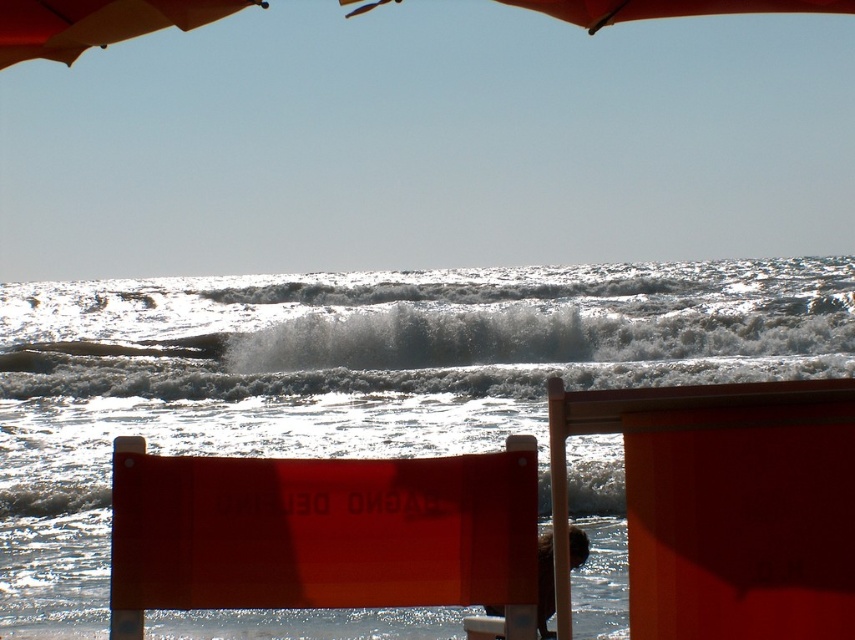
Between point (657, 339) and point (4, 65), which one is positioned in front?

Point (4, 65) is in front.

I want to click on white frothy wave at center, so click(435, 330).

Based on the photo, does transparent plastic sign at center have a larger size compared to orange fabric umbrella at upper center?

Actually, transparent plastic sign at center might be smaller than orange fabric umbrella at upper center.

Which is in front, point (286, 557) or point (86, 49)?

Point (286, 557) is in front.

Who is more distant from viewer, (378, 488) or (111, 26)?

Positioned behind is point (111, 26).

Locate an element on the screen. This screenshot has height=640, width=855. transparent plastic sign at center is located at coordinates (322, 532).

Is white frothy wave at center bigger than matte orange umbrella at upper left?

Yes.

From the picture: Can you confirm if white frothy wave at center is thinner than matte orange umbrella at upper left?

No, white frothy wave at center is not thinner than matte orange umbrella at upper left.

Does point (547, 308) come behind point (42, 8)?

Yes.

This screenshot has height=640, width=855. I want to click on white frothy wave at center, so click(435, 330).